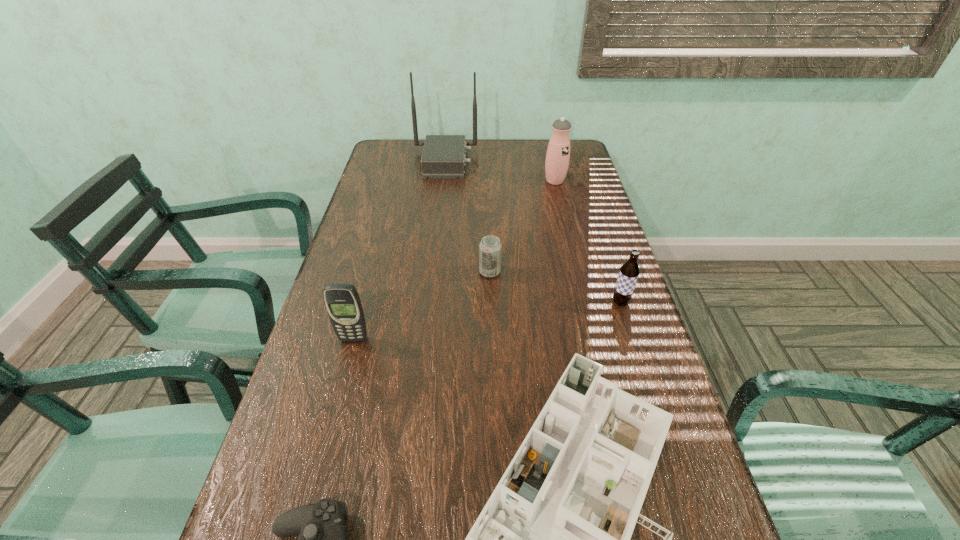
Locate an element on the screen. The image size is (960, 540). the tallest object is located at coordinates (443, 157).

Locate an element on the screen. the second tallest object is located at coordinates (558, 152).

You are a GUI agent. You are given a task and a screenshot of the screen. Output one action in this format:
    pyautogui.click(x=<x>, y=<y>)
    Task: Click on the third nearest object
    This screenshot has width=960, height=540.
    Given the screenshot: What is the action you would take?
    [342, 301]

Find the location of a particular element. Image resolution: width=960 pixels, height=540 pixels. the fourth farthest object is located at coordinates (629, 271).

I want to click on the fifth nearest object, so click(490, 248).

This screenshot has height=540, width=960. I want to click on free space located on the back of the tallest object to connect cables, so click(517, 162).

Locate an element on the screen. The image size is (960, 540). vacant space located 0.140m on the left of the thermos bottle is located at coordinates (504, 181).

Image resolution: width=960 pixels, height=540 pixels. I want to click on vacant space located on the screen of the fifth farthest object, so click(337, 403).

Identify the location of free point located 0.060m on the back of the root beer. (613, 280).

The width and height of the screenshot is (960, 540). I want to click on vacant space situated on the left of the fifth nearest object, so click(457, 272).